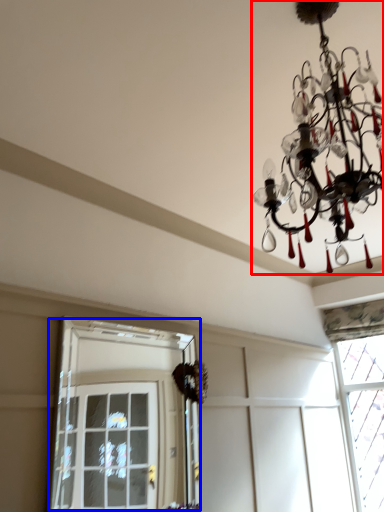
Question: Which object appears farthest to the camera in this image, lamp (highlighted by a red box) or window (highlighted by a blue box)?

Choices:
 (A) lamp
 (B) window

Answer: (B)